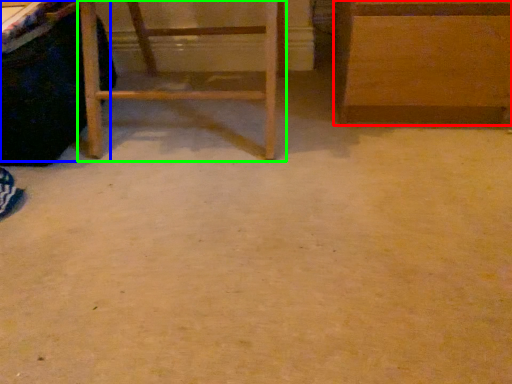
Question: Which is nearer to the furniture (highlighted by a red box)? vanity (highlighted by a blue box) or furniture (highlighted by a green box).

Choices:
 (A) vanity
 (B) furniture

Answer: (B)